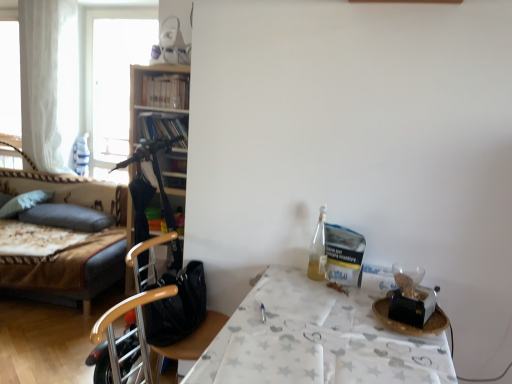
You are a GUI agent. You are given a task and a screenshot of the screen. Output one action in this format:
    pyautogui.click(x=<x>, y=<y>)
    Task: Click on the vacant space underneath white sheer curtain at left (from a real-world perspective)
    
    Given the screenshot: What is the action you would take?
    pyautogui.click(x=47, y=177)